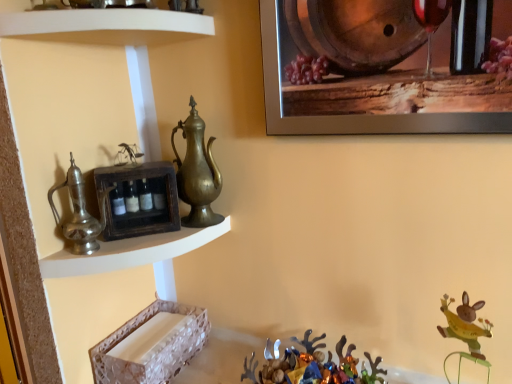
Image resolution: width=512 pixels, height=384 pixels. I want to click on free location in front of wooden crate at upper left, which appears as the 3th shelf when ordered from the bottom, so click(125, 247).